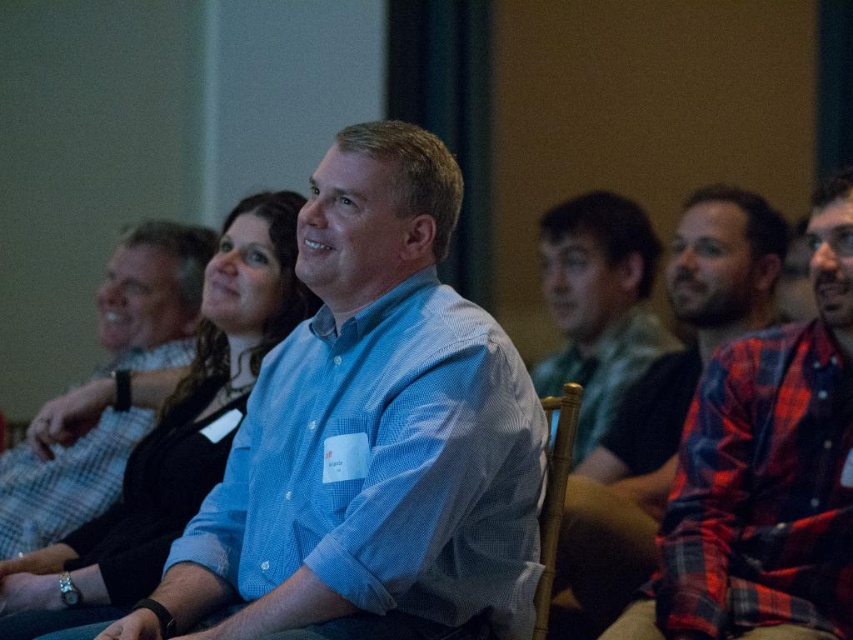
You are standing in the room and want to hand a document to the person wearing the blue shirt at center. Based on their position, where should you approach from?

The blue shirt at center is located at point (154,294), so you should approach from the front to reach them directly.

You are sitting in the back row of the conference room and see the blue shirt at center and the green fabric shirt at center. Which one is more to your left?

The blue shirt at center is more to the left since it is positioned on the left side of the green fabric shirt at center.

You are organizing a group photo and need to know if the red plaid shirt at right and the blue shirt at center can stand side by side without overlapping. The minimum required space between them is 5 feet. Can they fit?

The distance between the red plaid shirt at right and the blue shirt at center is 5.46 feet, which exceeds the required 5 feet, so they can stand side by side without overlapping.